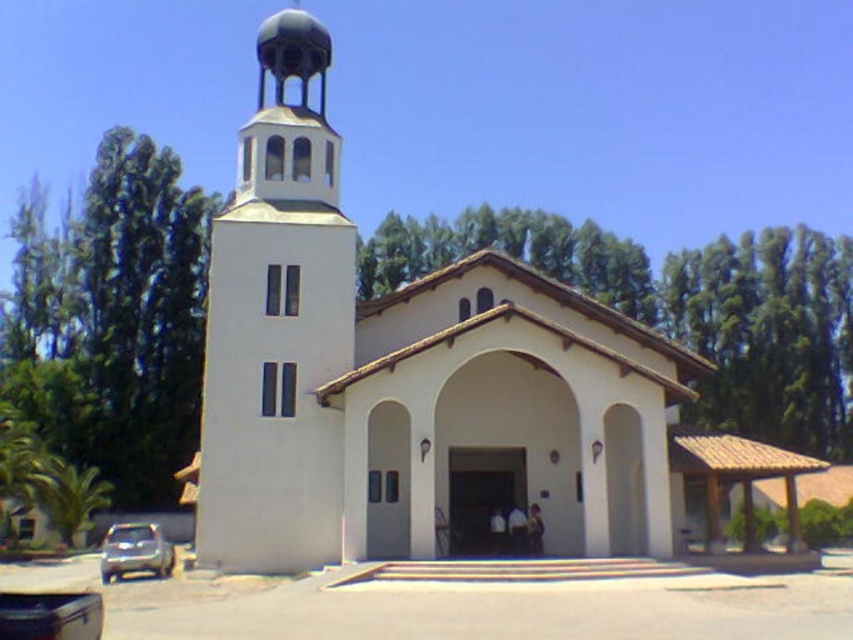
Is point (624, 349) farther from viewer compared to point (310, 65)?

No.

Where is `white smooth church at center`? This screenshot has width=853, height=640. white smooth church at center is located at coordinates (404, 374).

Is white smooth bell tower at center shorter than satin silver suv at lower left?

No, white smooth bell tower at center is not shorter than satin silver suv at lower left.

Which is more to the right, white smooth bell tower at center or satin silver suv at lower left?

white smooth bell tower at center

Where is `white smooth bell tower at center`? The width and height of the screenshot is (853, 640). white smooth bell tower at center is located at coordinates (277, 326).

Does white smooth church at center have a smaller size compared to satin silver suv at lower left?

Incorrect, white smooth church at center is not smaller in size than satin silver suv at lower left.

What do you see at coordinates (404, 374) in the screenshot? I see `white smooth church at center` at bounding box center [404, 374].

Is point (288, 259) farther from viewer compared to point (155, 550)?

Yes.

Identify the location of white smooth church at center. The width and height of the screenshot is (853, 640). (404, 374).